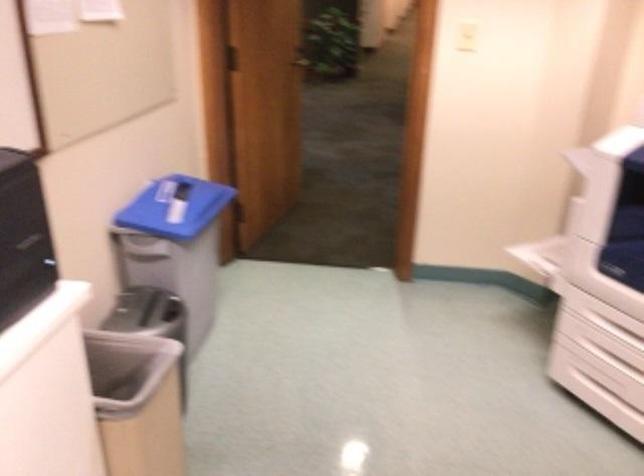
Image resolution: width=644 pixels, height=476 pixels. Find the location of `blue recycling lid`. blue recycling lid is located at coordinates (174, 207).